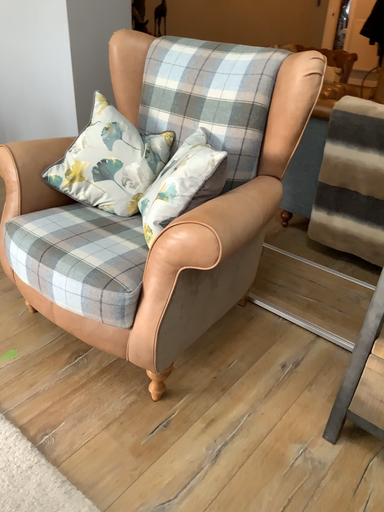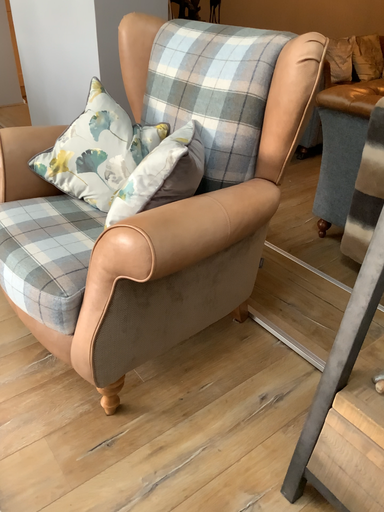
Question: Which way did the camera rotate in the video?

Choices:
 (A) rotated left
 (B) rotated right

Answer: (A)